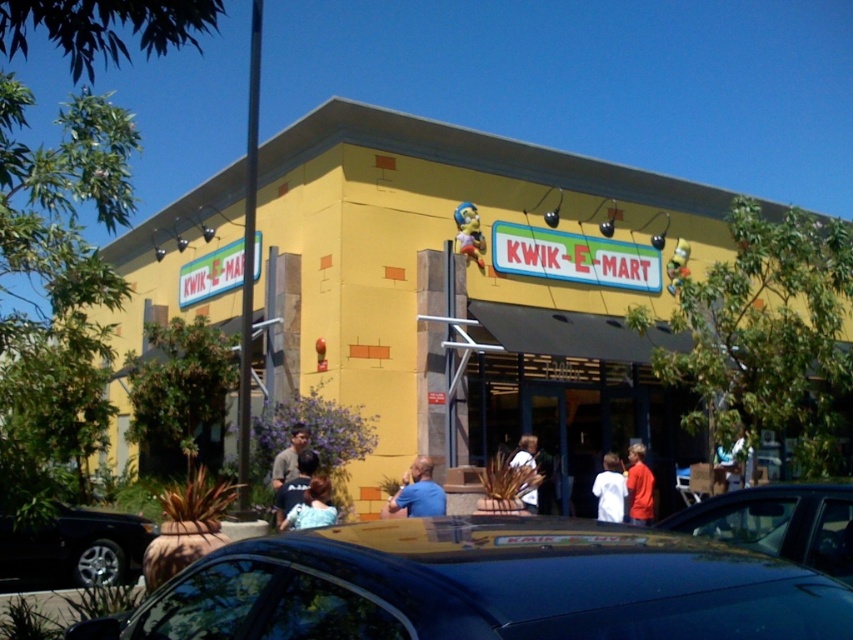
You are a customer standing in front of the KWIK E MART entrance. You see two people wearing a red matte shirt at center and a white shirt at center. Which one is positioned more to the right?

The red matte shirt at center is positioned to the right of the white shirt at center, so the red matte shirt at center is more to the right.

You are a delivery person who needs to park your shiny black car at lower left near the white fabric shirt at center. Since the car is larger than the shirt, will you have enough space to park the car without blocking the entrance?

The shiny black car at lower left is larger in size than white fabric shirt at center. Therefore, you have sufficient space to park the shiny black car at lower left near the white fabric shirt at center without blocking the entrance since the car can accommodate its size relative to the shirt.